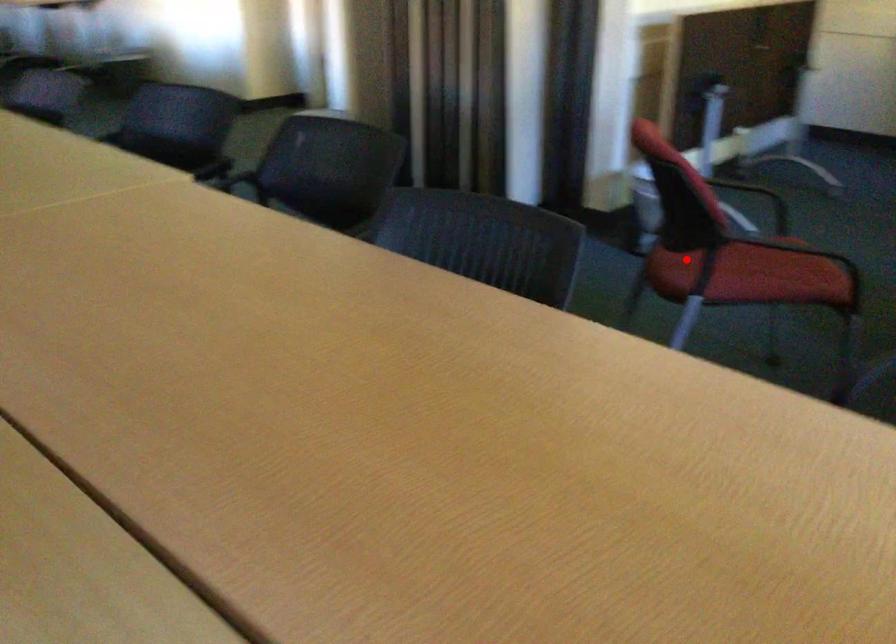
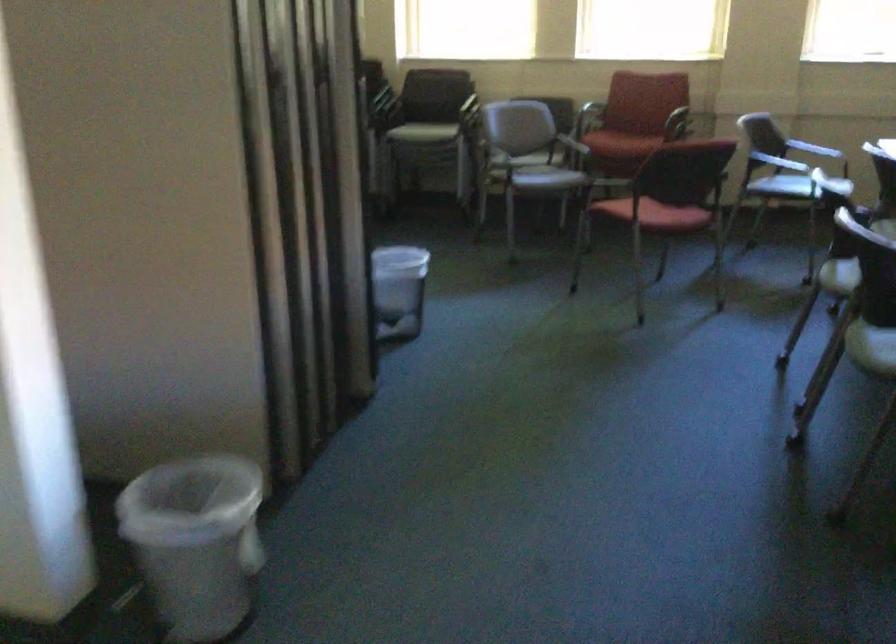
Question: A red point is marked in image1. In image2, is the corresponding 3D point closer to the camera or farther? Reply with the corresponding letter.

Choices:
 (A) The corresponding 3D point is closer.
 (B) The corresponding 3D point is farther.

Answer: (B)